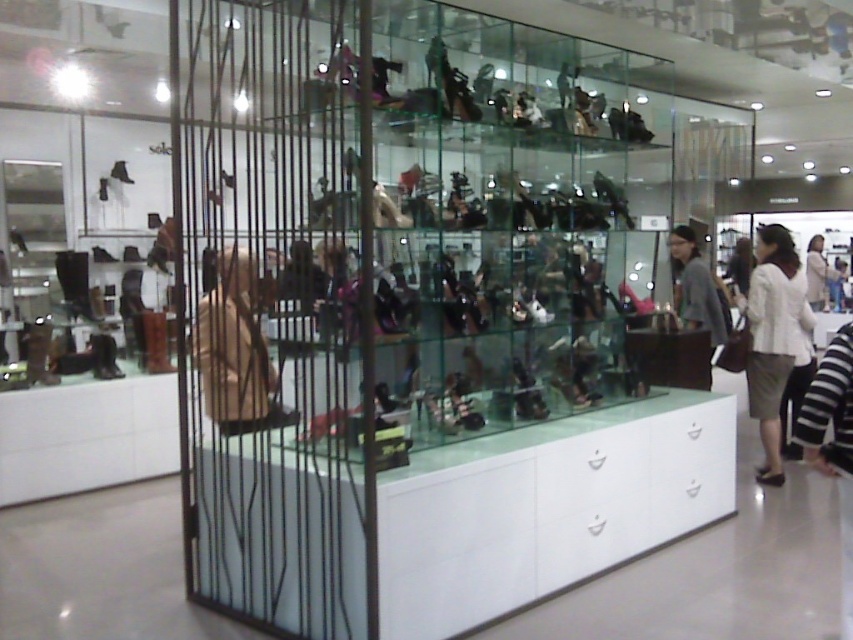
You are a customer in the store and want to see both the white fabric skirt at lower right and the gray fabric jacket at center. Since there is a black metal railing in front of the display, can you tell which item is easier to see through the railing?

The white fabric skirt at lower right is thinner than the gray fabric jacket at center, so it might be easier to see through the railing because it has less material blocking the view.

You are a customer in the store and want to see the shoes behind the black metal railing in front of you. There is a white fabric skirt at lower right and a gray fabric jacket at center. Which clothing item is taller, allowing you to see over the black metal railing better?

The white fabric skirt at lower right is much taller than the gray fabric jacket at center, so you can see over the black metal railing better by standing on the white fabric skirt at lower right.

You are a customer in the store and want to see the white fabric skirt at lower right. However, the gray fabric jacket at center is blocking your view. Can you move the jacket to get a better look at the skirt?

The white fabric skirt at lower right is positioned under the gray fabric jacket at center, so you can simply move the gray fabric jacket at center to reveal the skirt below.